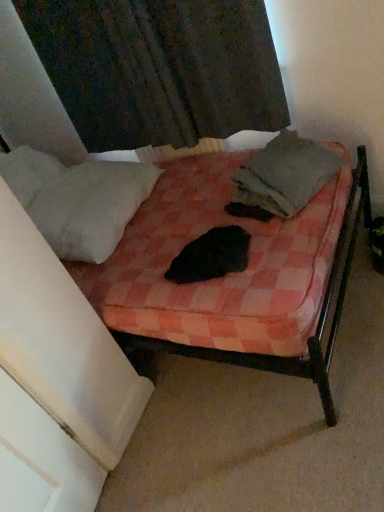
Locate an element on the screen. This screenshot has width=384, height=512. black fur at center is located at coordinates click(x=211, y=256).

The height and width of the screenshot is (512, 384). I want to click on white fluffy pillow at left, so click(91, 207).

Does dark fabric curtain at upper center have a greater height compared to pink checkered fabric bed at center?

Incorrect, the height of dark fabric curtain at upper center is not larger of that of pink checkered fabric bed at center.

This screenshot has height=512, width=384. What are the coordinates of `bed that appears on the left of dark fabric curtain at upper center` in the screenshot? It's located at (235, 274).

From the image's perspective, between dark fabric curtain at upper center and pink checkered fabric bed at center, who is located below?

pink checkered fabric bed at center.

From their relative heights in the image, would you say dark fabric curtain at upper center is taller or shorter than gray cotton blanket at center?

Considering their sizes, dark fabric curtain at upper center has more height than gray cotton blanket at center.

Considering the relative positions of dark fabric curtain at upper center and gray cotton blanket at center in the image provided, is dark fabric curtain at upper center to the left or to the right of gray cotton blanket at center?

From the image, it's evident that dark fabric curtain at upper center is to the left of gray cotton blanket at center.

From the image's perspective, between dark fabric curtain at upper center and gray cotton blanket at center, which one is located above?

From the image's view, dark fabric curtain at upper center is above.

Locate an element on the screen. The width and height of the screenshot is (384, 512). blanket below the dark fabric curtain at upper center (from a real-world perspective) is located at coordinates (285, 174).

Looking at this image, is white fluffy pillow at left not inside black fur at center?

Yes, white fluffy pillow at left is outside of black fur at center.

Find the location of `pillow above the black fur at center (from a real-world perspective)`. pillow above the black fur at center (from a real-world perspective) is located at coordinates (91, 207).

From the image's perspective, is white fluffy pillow at left below black fur at center?

No, from the image's perspective, white fluffy pillow at left is not beneath black fur at center.

Which is behind, white fluffy pillow at left or black fur at center?

white fluffy pillow at left is more distant.

Is white fluffy pillow at left surrounding dark fabric curtain at upper center?

That's incorrect, dark fabric curtain at upper center is not inside white fluffy pillow at left.

Which of these two, white fluffy pillow at left or dark fabric curtain at upper center, stands taller?

dark fabric curtain at upper center.

The width and height of the screenshot is (384, 512). I want to click on pillow that is below the dark fabric curtain at upper center (from the image's perspective), so click(x=91, y=207).

Is point (122, 168) closer or farther from the camera than point (218, 137)?

Point (122, 168) is closer to the camera than point (218, 137).

Is black fur at center in front of gray cotton blanket at center?

Yes, it is.

Identify the location of blanket that is above the black fur at center (from the image's perspective). The height and width of the screenshot is (512, 384). (285, 174).

How distant is black fur at center from gray cotton blanket at center?

black fur at center and gray cotton blanket at center are 11.06 inches apart from each other.

Considering the sizes of objects black fur at center and gray cotton blanket at center in the image provided, who is taller, black fur at center or gray cotton blanket at center?

gray cotton blanket at center is taller.

Is gray cotton blanket at center placed right next to pink checkered fabric bed at center?

No.

From the image's perspective, is gray cotton blanket at center above or below pink checkered fabric bed at center?

gray cotton blanket at center is situated higher than pink checkered fabric bed at center in the image.

Looking at this image, from a real-world perspective, is gray cotton blanket at center positioned over pink checkered fabric bed at center based on gravity?

Incorrect, from a real-world perspective, gray cotton blanket at center is lower than pink checkered fabric bed at center.

Is gray cotton blanket at center in front of or behind pink checkered fabric bed at center in the image?

gray cotton blanket at center is behind pink checkered fabric bed at center.

From a real-world perspective, between dark fabric curtain at upper center and black fur at center, who is vertically lower?

black fur at center.

From the image's perspective, is dark fabric curtain at upper center located beneath black fur at center?

No.

Does dark fabric curtain at upper center appear on the right side of black fur at center?

Incorrect, dark fabric curtain at upper center is not on the right side of black fur at center.

Where is `bed that appears below the dark fabric curtain at upper center (from a real-world perspective)`? The image size is (384, 512). bed that appears below the dark fabric curtain at upper center (from a real-world perspective) is located at coordinates (235, 274).

Image resolution: width=384 pixels, height=512 pixels. There is a gray cotton blanket at center. Find the location of `curtain above it (from a real-world perspective)`. curtain above it (from a real-world perspective) is located at coordinates (159, 68).

Based on their spatial positions, is white fluffy pillow at left or gray cotton blanket at center closer to black fur at center?

gray cotton blanket at center.

Which object lies further to the anchor point white fluffy pillow at left, black fur at center or pink checkered fabric bed at center?

black fur at center is positioned further to the anchor white fluffy pillow at left.

Looking at this image, when comparing their distances from dark fabric curtain at upper center, does pink checkered fabric bed at center or black fur at center seem further?

black fur at center lies further to dark fabric curtain at upper center than the other object.

Looking at the image, which one is located closer to pink checkered fabric bed at center, dark fabric curtain at upper center or white fluffy pillow at left?

white fluffy pillow at left.

Looking at this image, when comparing their distances from dark fabric curtain at upper center, does gray cotton blanket at center or pink checkered fabric bed at center seem further?

The object further to dark fabric curtain at upper center is pink checkered fabric bed at center.

Based on their spatial positions, is gray cotton blanket at center or dark fabric curtain at upper center further from pink checkered fabric bed at center?

The object further to pink checkered fabric bed at center is dark fabric curtain at upper center.

Based on their spatial positions, is gray cotton blanket at center or white fluffy pillow at left closer to black fur at center?

gray cotton blanket at center lies closer to black fur at center than the other object.

Based on their spatial positions, is black fur at center or white fluffy pillow at left closer to pink checkered fabric bed at center?

Answer: Among the two, black fur at center is located nearer to pink checkered fabric bed at center.

This screenshot has width=384, height=512. In order to click on bed between white fluffy pillow at left and gray cotton blanket at center from left to right in this screenshot , I will do `click(235, 274)`.

You are a GUI agent. You are given a task and a screenshot of the screen. Output one action in this format:
    pyautogui.click(x=<x>, y=<y>)
    Task: Click on the curtain positioned between pink checkered fabric bed at center and white fluffy pillow at left from near to far
    The width and height of the screenshot is (384, 512).
    Given the screenshot: What is the action you would take?
    pyautogui.click(x=159, y=68)

I want to click on curtain between pink checkered fabric bed at center and gray cotton blanket at center from left to right, so click(159, 68).

You are a GUI agent. You are given a task and a screenshot of the screen. Output one action in this format:
    pyautogui.click(x=<x>, y=<y>)
    Task: Click on the pillow between dark fabric curtain at upper center and black fur at center in the up-down direction
    
    Given the screenshot: What is the action you would take?
    pyautogui.click(x=91, y=207)